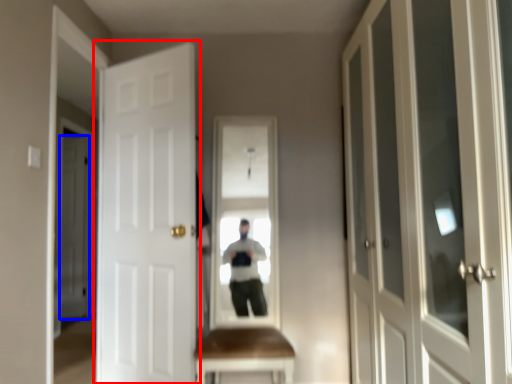
Question: Which object is closer to the camera taking this photo, door (highlighted by a red box) or door (highlighted by a blue box)?

Choices:
 (A) door
 (B) door

Answer: (A)